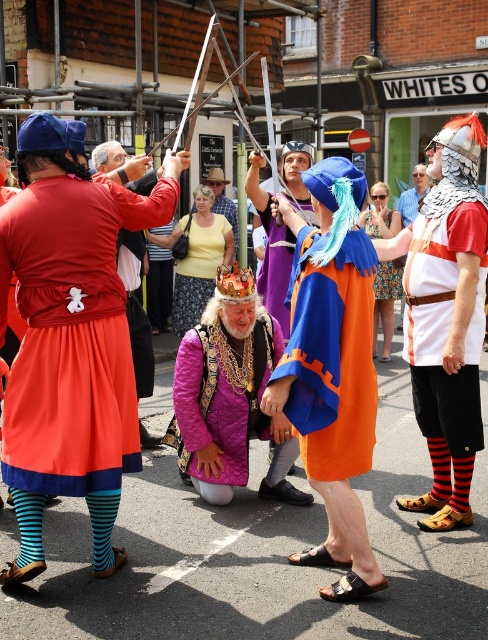
Based on the scene description, where is the orange fabric cape at center located in terms of coordinates?

The orange fabric cape at center is located at coordinates point (331, 356).

You are a photographer trying to capture the entire scene. You notice the matte red skirt at left and the purple quilted tunic at center. Which object is covering part of the other?

The matte red skirt at left is positioned over the purple quilted tunic at center, so the matte red skirt at left is covering part of the purple quilted tunic at center.

You are a photographer standing 2 meters away from the matte red skirt at left and purple quilted tunic at center. You want to capture both subjects in a single frame. Can you fit both in your camera view if your camera has a 1.5 meter wide field of view?

The distance between the matte red skirt at left and the purple quilted tunic at center is 1.04 meters, which is less than the camera field of view of 1.5 meters. Therefore, both subjects can be captured in a single frame.